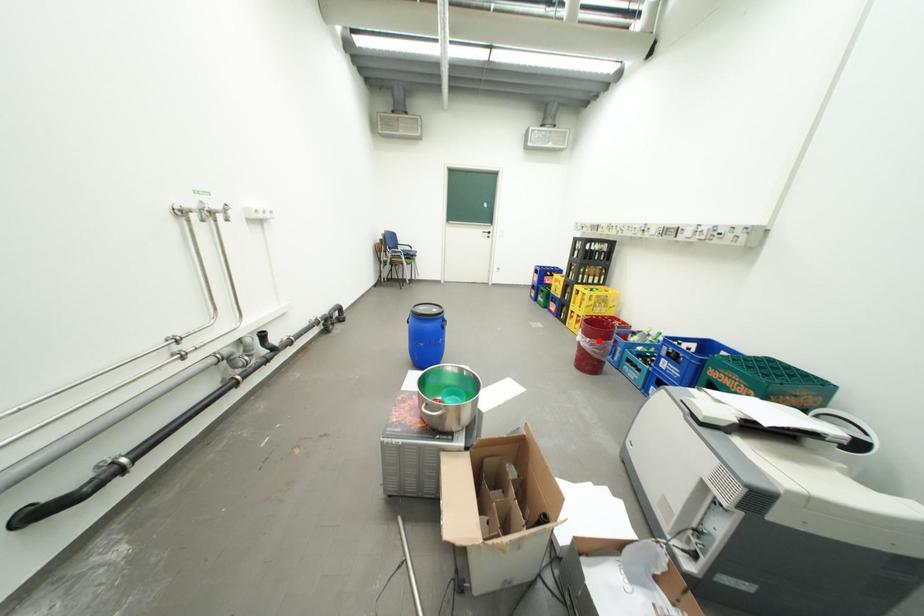
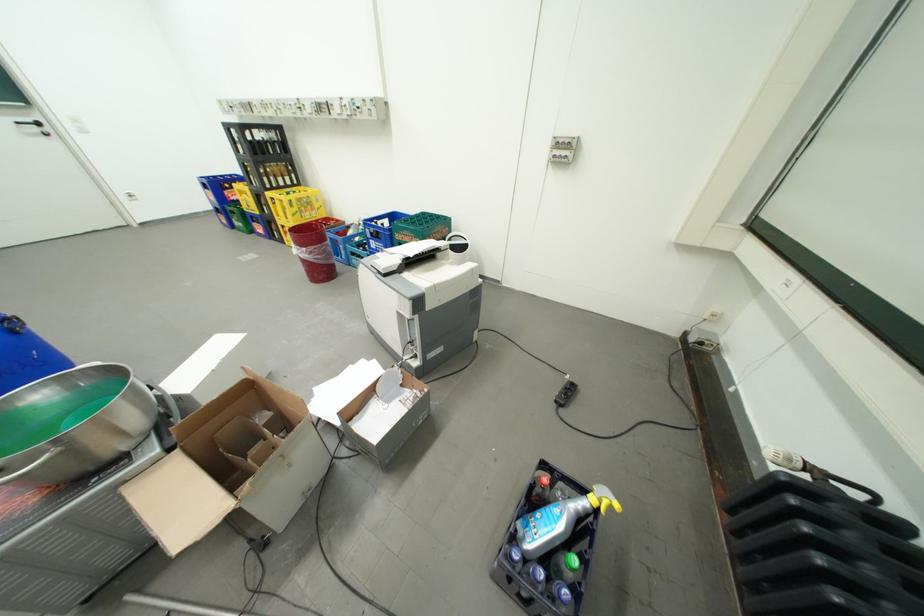
Where in the second image is the point corresponding to the highlighted location from the first image?

(314, 249)